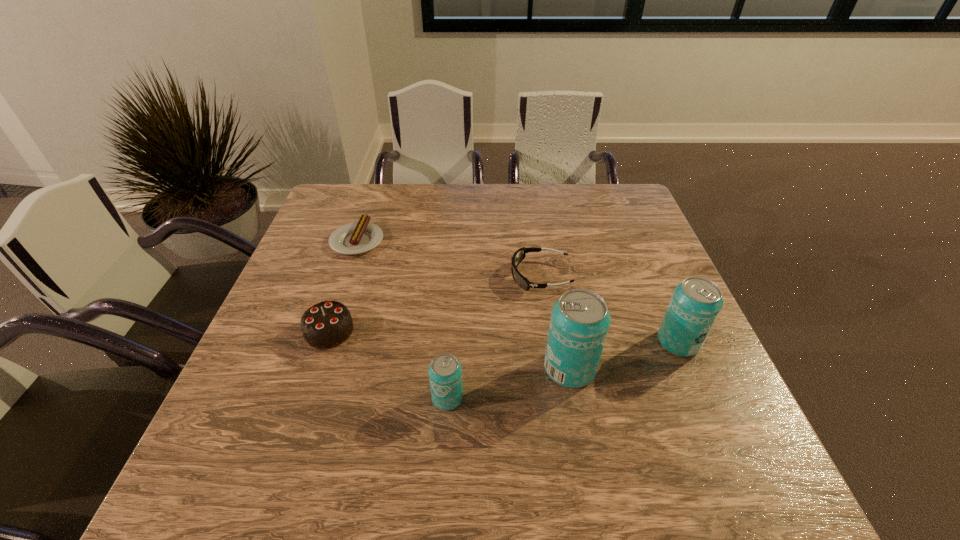
Find the location of `the third tallest object`. the third tallest object is located at coordinates (445, 372).

Find the location of a particular element. the shortest beer can is located at coordinates tap(445, 372).

Find the location of `the second beer can from left to right`. the second beer can from left to right is located at coordinates (579, 323).

Where is `the second tallest beer can`? The height and width of the screenshot is (540, 960). the second tallest beer can is located at coordinates (695, 304).

Where is `the rightmost beer can`? This screenshot has height=540, width=960. the rightmost beer can is located at coordinates (695, 304).

This screenshot has height=540, width=960. Identify the location of the second shortest object. (518, 256).

What are the coordinates of `sausage` in the screenshot? It's located at (358, 237).

This screenshot has width=960, height=540. I want to click on the fourth tallest object, so tap(327, 324).

At what (x,y) coordinates should I click in order to perform the action: click on vacant area located on the left of the shortest beer can. Please return your answer as a coordinate pair (x, y). The image size is (960, 540). Looking at the image, I should click on (372, 398).

The height and width of the screenshot is (540, 960). What are the coordinates of `vacant position located 0.140m on the right of the second beer can from right to left` in the screenshot? It's located at (660, 368).